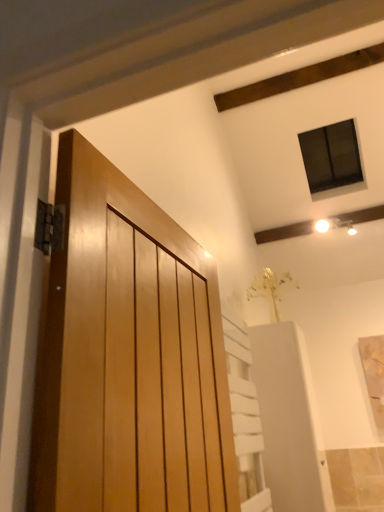
Question: From the image's perspective, is glossy wood door at left positioned above or below white matte elevator at lower right?

Choices:
 (A) above
 (B) below

Answer: (A)

Question: Relative to white matte elevator at lower right, is glossy wood door at left in front or behind?

Choices:
 (A) front
 (B) behind

Answer: (A)

Question: Is glossy wood door at left wider or thinner than white matte elevator at lower right?

Choices:
 (A) thin
 (B) wide

Answer: (A)

Question: From a real-world perspective, is white matte elevator at lower right positioned above or below glossy wood door at left?

Choices:
 (A) below
 (B) above

Answer: (A)

Question: Considering the relative positions of white matte elevator at lower right and glossy wood door at left in the image provided, is white matte elevator at lower right to the left or to the right of glossy wood door at left?

Choices:
 (A) right
 (B) left

Answer: (A)

Question: Considering their positions, is white matte elevator at lower right located in front of or behind glossy wood door at left?

Choices:
 (A) front
 (B) behind

Answer: (B)

Question: Is point (311, 395) positioned closer to the camera than point (142, 423)?

Choices:
 (A) closer
 (B) farther

Answer: (B)